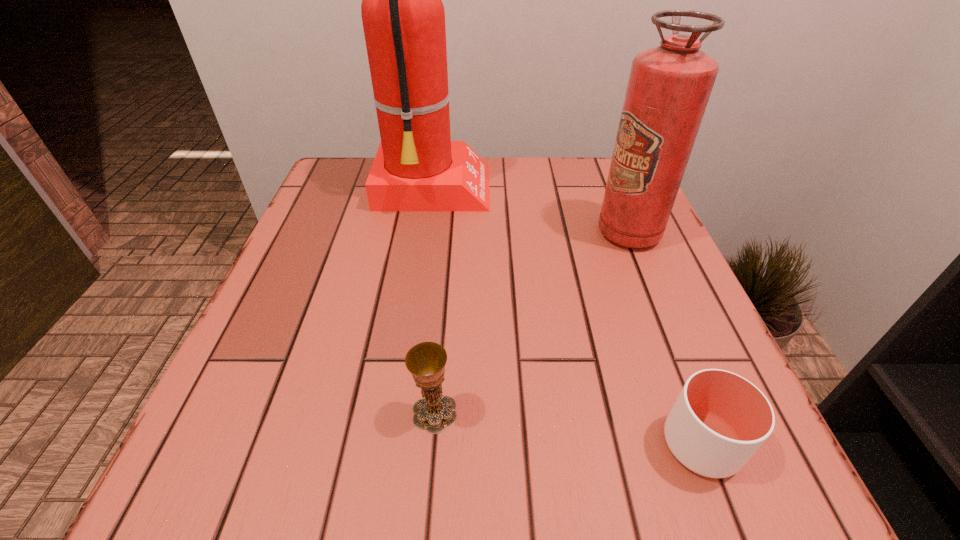
The width and height of the screenshot is (960, 540). What are the coordinates of `free region at the left edge of the desktop` in the screenshot? It's located at (275, 321).

Where is `vacant space at the right edge of the desktop`? This screenshot has width=960, height=540. vacant space at the right edge of the desktop is located at coordinates [x=683, y=320].

Image resolution: width=960 pixels, height=540 pixels. I want to click on vacant space at the far left corner of the desktop, so click(371, 168).

Identify the location of vacant point at the near left corner. (309, 463).

This screenshot has height=540, width=960. Identify the location of vacant space at the near right corner. (780, 468).

The height and width of the screenshot is (540, 960). I want to click on empty location between the shorter fire extinguisher and the second shortest object, so click(532, 322).

Identify the location of free spot between the second shortest object and the cup. (567, 428).

Image resolution: width=960 pixels, height=540 pixels. In order to click on vacant space that is in between the left fire extinguisher and the third shortest object in this screenshot , I will do `click(531, 212)`.

Locate an element on the screen. The image size is (960, 540). free area in between the second tallest object and the taller fire extinguisher is located at coordinates (531, 212).

Locate an element on the screen. empty location between the left fire extinguisher and the third tallest object is located at coordinates (434, 301).